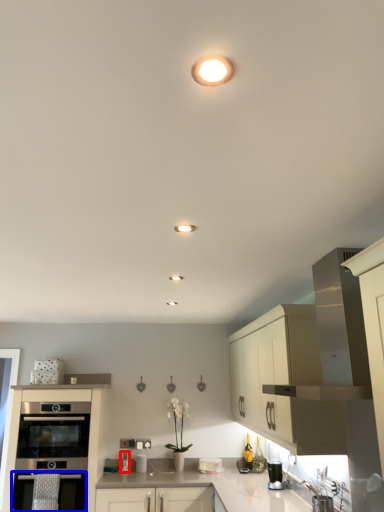
Question: Which of the following is the farthest to the observer, appliance (highlighted by a red box) or oven (highlighted by a blue box)?

Choices:
 (A) appliance
 (B) oven

Answer: (A)